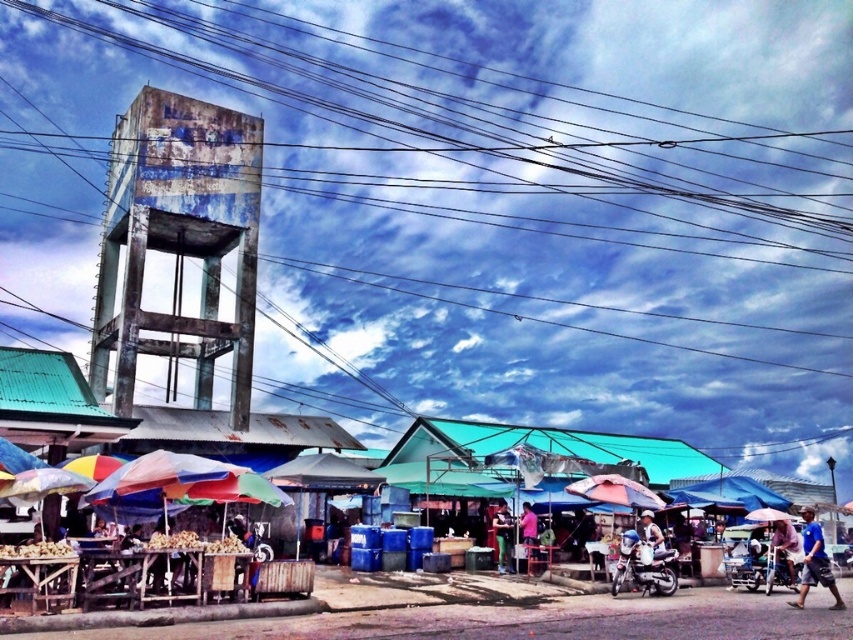
Between wooden tables at lower left and blue fabric canopy at center, which one is positioned higher?

blue fabric canopy at center

Between wooden tables at lower left and blue fabric canopy at center, which one appears on the left side from the viewer's perspective?

wooden tables at lower left

Where is `wooden tables at lower left`? wooden tables at lower left is located at coordinates (355, 596).

Where is `wooden tables at lower left`? This screenshot has width=853, height=640. wooden tables at lower left is located at coordinates (355, 596).

Is blue fabric canopy at center to the left of green fabric shirt at center from the viewer's perspective?

Incorrect, blue fabric canopy at center is not on the left side of green fabric shirt at center.

Based on the photo, can you confirm if blue fabric canopy at center is bigger than green fabric shirt at center?

Yes.

Is point (738, 490) more distant than point (505, 564)?

Yes, point (738, 490) is farther from viewer.

At what (x,y) coordinates should I click in order to perform the action: click on blue fabric canopy at center. Please return your answer as a coordinate pair (x, y). Looking at the image, I should click on (728, 493).

Looking at this image, who is higher up, rusty metal power lines at upper center or blue fabric umbrella at lower right?

rusty metal power lines at upper center is above.

Who is taller, rusty metal power lines at upper center or blue fabric umbrella at lower right?

Standing taller between the two is rusty metal power lines at upper center.

Is point (379, 156) in front of point (820, 538)?

No.

Image resolution: width=853 pixels, height=640 pixels. What are the coordinates of `rusty metal power lines at upper center` in the screenshot? It's located at (473, 189).